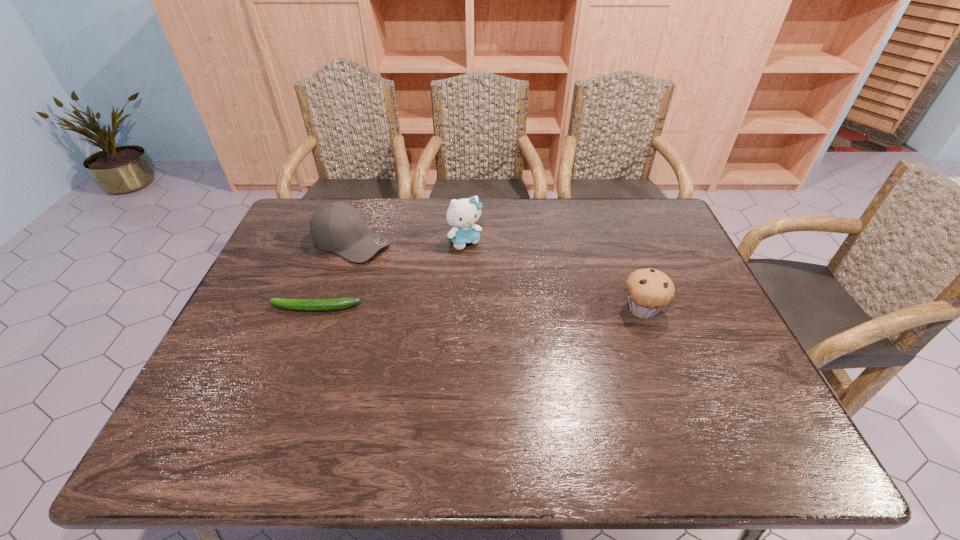
The height and width of the screenshot is (540, 960). In order to click on free region located on the front brim of the baseball cap in this screenshot , I will do pyautogui.click(x=472, y=295).

Where is `free spot located 0.350m on the front brim of the baseball cap`? This screenshot has width=960, height=540. free spot located 0.350m on the front brim of the baseball cap is located at coordinates (478, 298).

Where is `free region located 0.060m on the front brim of the baseball cap`? The image size is (960, 540). free region located 0.060m on the front brim of the baseball cap is located at coordinates [397, 261].

Locate an element on the screen. This screenshot has width=960, height=540. kitten located in the far edge section of the desktop is located at coordinates (461, 214).

This screenshot has width=960, height=540. In order to click on baseball cap located at the far edge in this screenshot , I will do `click(338, 227)`.

Locate an element on the screen. Image resolution: width=960 pixels, height=540 pixels. zucchini located at the left edge is located at coordinates (337, 303).

This screenshot has width=960, height=540. In order to click on baseball cap located in the left edge section of the desktop in this screenshot , I will do `click(338, 227)`.

Where is `object positioned at the right edge`? object positioned at the right edge is located at coordinates (649, 290).

You are a GUI agent. You are given a task and a screenshot of the screen. Output one action in this format:
    pyautogui.click(x=<x>, y=<y>)
    Task: Click on the object at the far left corner
    
    Given the screenshot: What is the action you would take?
    pyautogui.click(x=338, y=227)

Locate an element on the screen. This screenshot has height=540, width=960. free region at the far edge of the desktop is located at coordinates (496, 202).